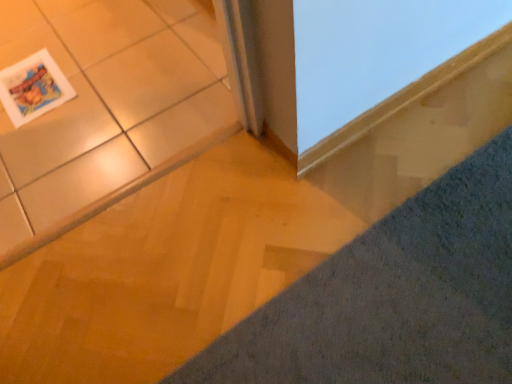
Question: Can you confirm if smooth wood frame at upper right is taller than gray textured carpet at lower right?

Choices:
 (A) no
 (B) yes

Answer: (B)

Question: Can we say smooth wood frame at upper right lies outside gray textured carpet at lower right?

Choices:
 (A) no
 (B) yes

Answer: (B)

Question: From the image's perspective, is smooth wood frame at upper right located above gray textured carpet at lower right?

Choices:
 (A) yes
 (B) no

Answer: (A)

Question: Is gray textured carpet at lower right located within smooth wood frame at upper right?

Choices:
 (A) no
 (B) yes

Answer: (A)

Question: Does smooth wood frame at upper right have a lesser width compared to gray textured carpet at lower right?

Choices:
 (A) no
 (B) yes

Answer: (B)

Question: From the image's perspective, does smooth wood frame at upper right appear lower than gray textured carpet at lower right?

Choices:
 (A) no
 (B) yes

Answer: (A)

Question: Is matte paper magazine at upper left facing away from smooth wood frame at upper right?

Choices:
 (A) no
 (B) yes

Answer: (A)

Question: Is matte paper magazine at upper left smaller than smooth wood frame at upper right?

Choices:
 (A) yes
 (B) no

Answer: (A)

Question: Is the surface of matte paper magazine at upper left in direct contact with smooth wood frame at upper right?

Choices:
 (A) yes
 (B) no

Answer: (B)

Question: Does matte paper magazine at upper left have a greater height compared to smooth wood frame at upper right?

Choices:
 (A) no
 (B) yes

Answer: (A)

Question: From a real-world perspective, is matte paper magazine at upper left physically above smooth wood frame at upper right?

Choices:
 (A) yes
 (B) no

Answer: (B)

Question: Is matte paper magazine at upper left outside smooth wood frame at upper right?

Choices:
 (A) no
 (B) yes

Answer: (B)

Question: Considering the relative sizes of gray textured carpet at lower right and smooth wood frame at upper right in the image provided, is gray textured carpet at lower right shorter than smooth wood frame at upper right?

Choices:
 (A) yes
 (B) no

Answer: (A)